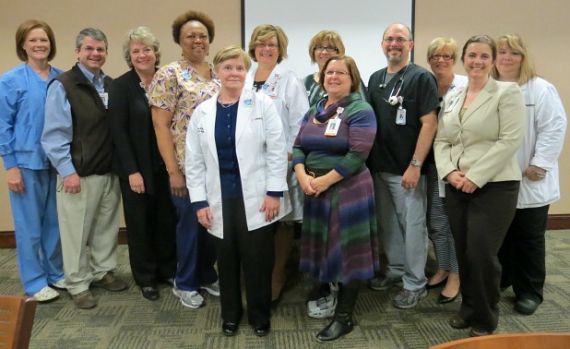
Where is `carpet`? carpet is located at coordinates (154, 320).